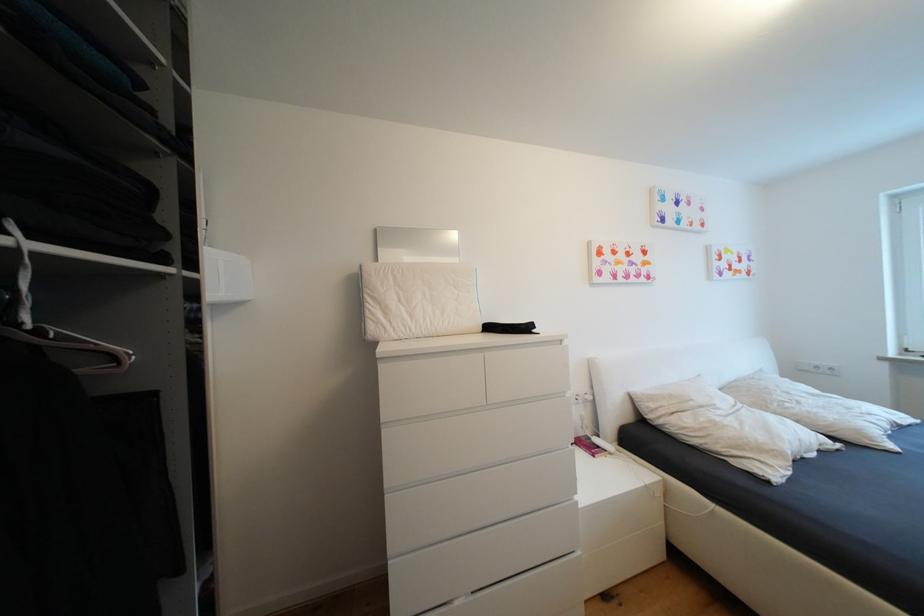
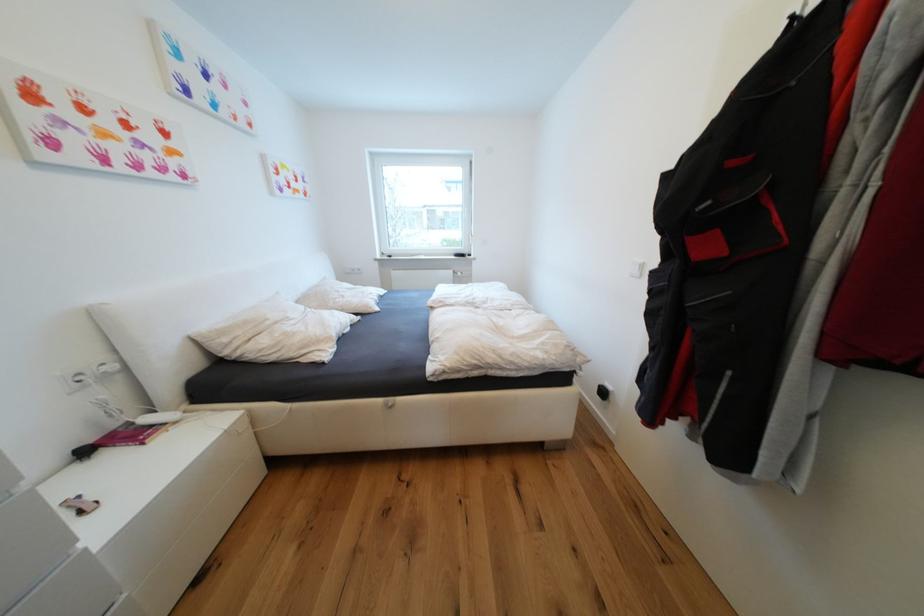
Locate, in the second image, the point that corresponds to the point at 806,403 in the first image.

(349, 297)